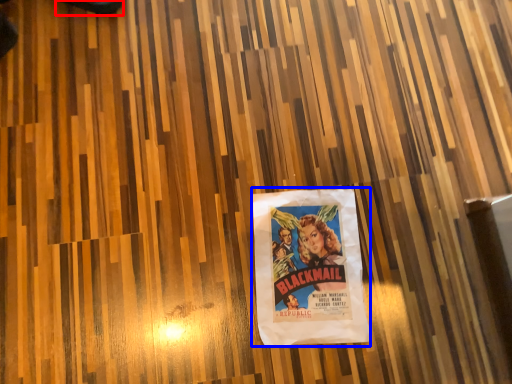
Question: Which object is further to the camera taking this photo, shoe (highlighted by a red box) or poster (highlighted by a blue box)?

Choices:
 (A) shoe
 (B) poster

Answer: (A)